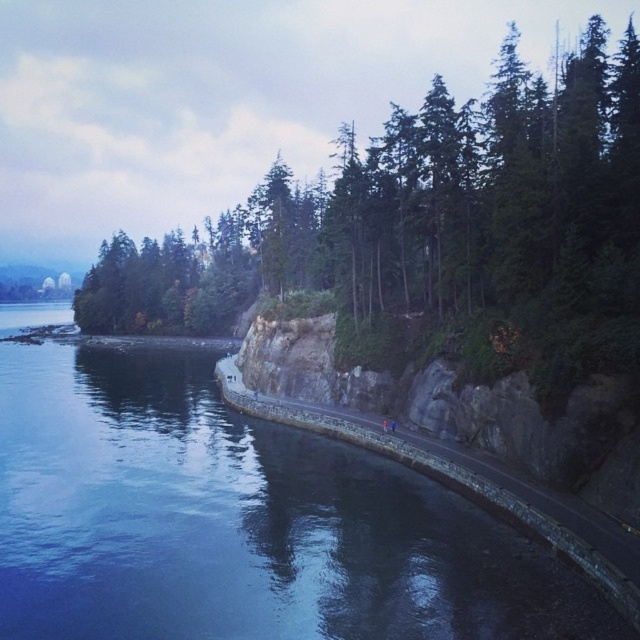
Question: Is dark blue water at center wider than dark gray asphalt road at center?

Choices:
 (A) yes
 (B) no

Answer: (A)

Question: Is dark blue water at center to the left of green textured trees at center from the viewer's perspective?

Choices:
 (A) no
 (B) yes

Answer: (B)

Question: Among these objects, which one is farthest from the camera?

Choices:
 (A) green textured trees at center
 (B) dark gray asphalt road at center
 (C) dark blue water at center

Answer: (A)

Question: Estimate the real-world distances between objects in this image. Which object is farther from the dark blue water at center?

Choices:
 (A) green textured trees at center
 (B) dark gray asphalt road at center

Answer: (A)

Question: Estimate the real-world distances between objects in this image. Which object is farther from the dark gray asphalt road at center?

Choices:
 (A) dark blue water at center
 (B) green textured trees at center

Answer: (B)

Question: Is green textured trees at center positioned behind dark gray asphalt road at center?

Choices:
 (A) no
 (B) yes

Answer: (B)